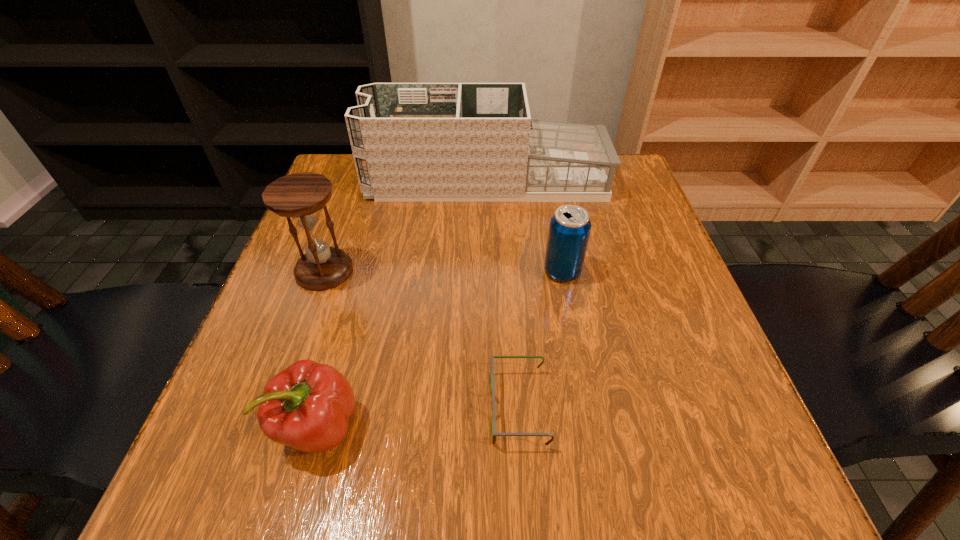
Locate an element on the screen. The height and width of the screenshot is (540, 960). the farthest object is located at coordinates (411, 142).

This screenshot has width=960, height=540. Identify the location of hourglass. (299, 195).

Where is `pop soda`? The image size is (960, 540). pop soda is located at coordinates (569, 230).

I want to click on pepper, so click(x=307, y=406).

Locate an element on the screen. The height and width of the screenshot is (540, 960). spectacles is located at coordinates (494, 434).

What are the coordinates of `free space located 0.110m at the entrance of the dollhouse` in the screenshot? It's located at (324, 180).

You are a GUI agent. You are given a task and a screenshot of the screen. Output one action in this format:
    pyautogui.click(x=<x>, y=<y>)
    Task: Click on the free region located on the back of the hourglass
    The width and height of the screenshot is (960, 540).
    Given the screenshot: What is the action you would take?
    pyautogui.click(x=337, y=237)

Where is `vacant space situated 0.290m on the front of the third tallest object`? vacant space situated 0.290m on the front of the third tallest object is located at coordinates (591, 426).

Locate an element on the screen. This screenshot has width=960, height=540. vacant space located on the back of the second shortest object is located at coordinates (353, 301).

Image resolution: width=960 pixels, height=540 pixels. What are the coordinates of `vacant area situated 0.260m on the lens of the shortest object` in the screenshot? It's located at (322, 408).